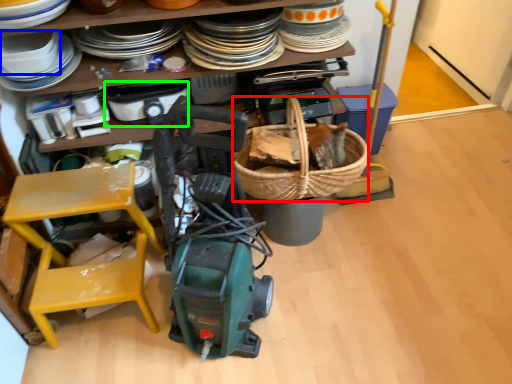
Question: Considering the real-world distances, which object is farthest from basket (highlighted by a red box)? appliance (highlighted by a blue box) or appliance (highlighted by a green box)?

Choices:
 (A) appliance
 (B) appliance

Answer: (A)